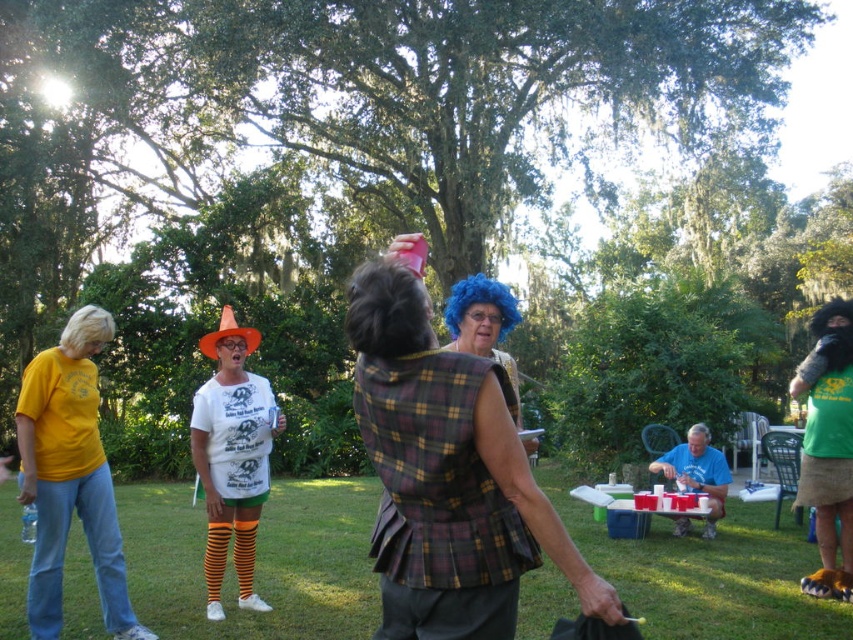
In the scene shown: You are planning to place a 3.5 meter long banner between the blue synthetic wig at center and the blonde synthetic wig at upper left. Will the banner fit perfectly between them without overlapping either wig?

The distance between the blue synthetic wig at center and the blonde synthetic wig at upper left is 4.68 meters. Since the banner is 3.5 meters long, it will fit between them with 1.18 meters of space remaining on either side.

Looking at this image, you are at a party in a backyard and want to find the blue plaid vest at center. Where should you look relative to the blonde synthetic wig at upper left?

The blue plaid vest at center is located below the blonde synthetic wig at upper left, so you should look downward from the blonde synthetic wig at upper left to find it.